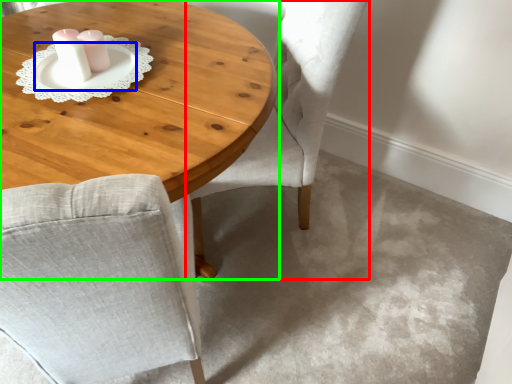
Question: Which object is the closest to the chair (highlighted by a red box)? Choose among these: saucer (highlighted by a blue box) or coffee table (highlighted by a green box).

Choices:
 (A) saucer
 (B) coffee table

Answer: (B)